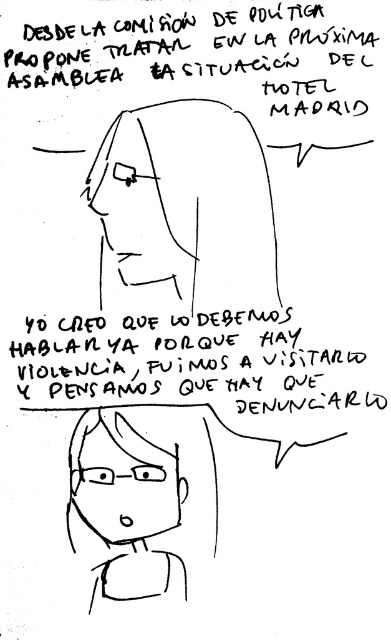
Does black paper text at upper center appear over black handwritten text at center?

Indeed, black paper text at upper center is positioned over black handwritten text at center.

Which is behind, point (303, 45) or point (310, 372)?

The point (310, 372) is more distant.

Locate an element on the screen. The width and height of the screenshot is (391, 640). black paper text at upper center is located at coordinates (193, 45).

Which of these two, matte black hair at upper center or black handwritten text at center, stands taller?

Standing taller between the two is matte black hair at upper center.

Can you confirm if matte black hair at upper center is positioned below black handwritten text at center?

No.

Does point (263, 157) come closer to viewer compared to point (125, 346)?

Yes, point (263, 157) is closer to viewer.

You are a GUI agent. You are given a task and a screenshot of the screen. Output one action in this format:
    pyautogui.click(x=<x>, y=<y>)
    Task: Click on the matte black hair at upper center
    Image resolution: width=391 pixels, height=640 pixels.
    Given the screenshot: What is the action you would take?
    pyautogui.click(x=184, y=209)

From the picture: Is matte black hair at upper center further to the viewer compared to black paper text at upper center?

Yes, matte black hair at upper center is further from the viewer.

Describe the element at coordinates (184, 209) in the screenshot. I see `matte black hair at upper center` at that location.

Find the location of a particular element. The height and width of the screenshot is (640, 391). matte black hair at upper center is located at coordinates (184, 209).